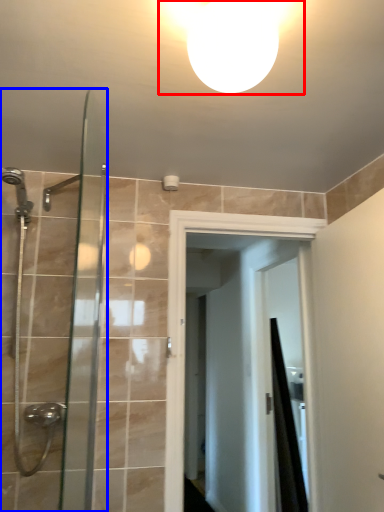
Question: Among these objects, which one is nearest to the camera, light fixture (highlighted by a red box) or shower door (highlighted by a blue box)?

Choices:
 (A) light fixture
 (B) shower door

Answer: (A)